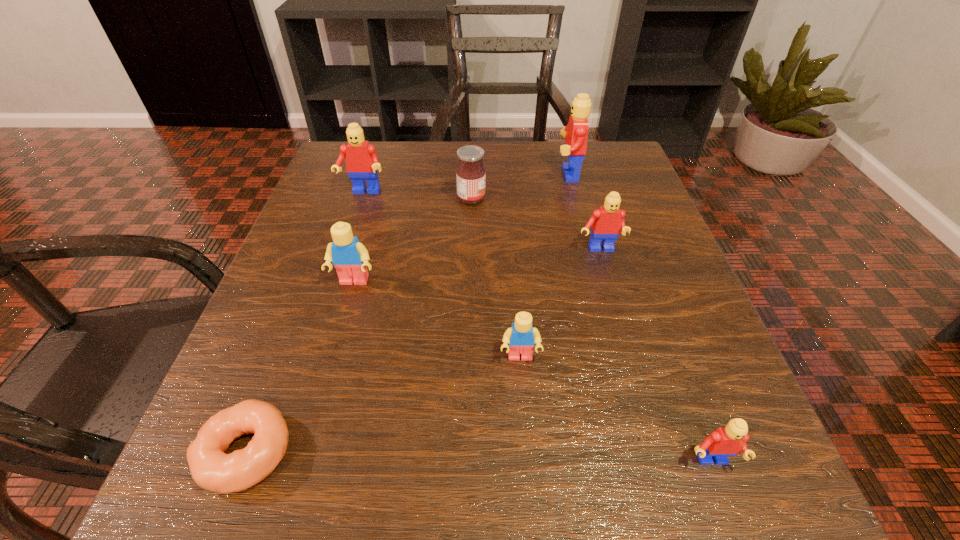
You are a GUI agent. You are given a task and a screenshot of the screen. Output one action in this format:
    pyautogui.click(x=<x>, y=<y>)
    Task: Click on the free space between the tan doughnut and the nearest red Lego
    The height and width of the screenshot is (540, 960).
    Given the screenshot: What is the action you would take?
    pyautogui.click(x=479, y=457)

Where is `free space between the third smallest red Lego and the fifth nearest object`? The width and height of the screenshot is (960, 540). free space between the third smallest red Lego and the fifth nearest object is located at coordinates [481, 221].

Image resolution: width=960 pixels, height=540 pixels. What are the coordinates of `free spot between the fourth Lego from right to left and the tan doughnut` in the screenshot? It's located at (384, 404).

You are a GUI agent. You are given a task and a screenshot of the screen. Output one action in this format:
    pyautogui.click(x=<x>, y=<y>)
    Task: Click on the free area in between the leftmost red Lego and the doughnut
    
    Given the screenshot: What is the action you would take?
    pyautogui.click(x=305, y=322)

This screenshot has height=540, width=960. I want to click on vacant point located between the bigger yellow Lego and the fifth object from right to left, so click(413, 240).

You are a GUI agent. You are given a task and a screenshot of the screen. Output one action in this format:
    pyautogui.click(x=<x>, y=<y>)
    Task: Click on the free space that is in between the sixth farthest object and the second tallest object
    Image resolution: width=960 pixels, height=540 pixels.
    Given the screenshot: What is the action you would take?
    pyautogui.click(x=442, y=275)

This screenshot has height=540, width=960. Find the location of `vacant area that lies between the tallest Lego and the smallest red Lego`. vacant area that lies between the tallest Lego and the smallest red Lego is located at coordinates [x=638, y=318].

I want to click on object that is the third closest one to the fifth object from right to left, so click(x=607, y=222).

Select which object appears as the seventh closest to the nearest red Lego. Please provide its 2D coordinates. Your answer should be formatted as a tuple, i.e. [(x, y)], where the tuple contains the x and y coordinates of a point satisfying the conditions above.

[(362, 163)]

The image size is (960, 540). I want to click on the fourth closest Lego to the jam, so click(x=350, y=257).